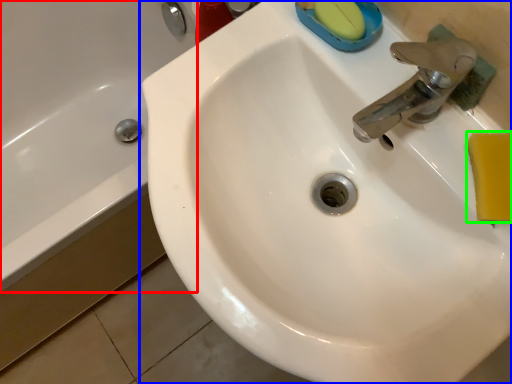
Question: Considering the real-world distances, which object is closest to bath (highlighted by a red box)? sink (highlighted by a blue box) or soap (highlighted by a green box).

Choices:
 (A) sink
 (B) soap

Answer: (A)